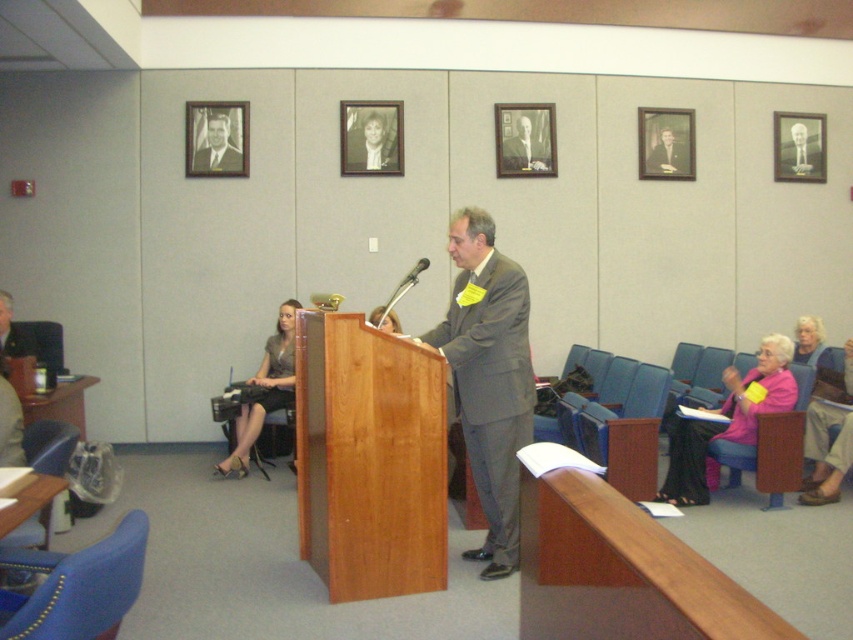
Between point (531, 140) and point (660, 157), which one is positioned behind?

Positioned behind is point (660, 157).

In the scene shown: Between smooth gray suit at center and formal suit at center, which one has less height?

With less height is formal suit at center.

Does point (515, 129) come closer to viewer compared to point (679, 147)?

That is True.

Locate an element on the screen. smooth gray suit at center is located at coordinates (526, 148).

Which of these two, gray suit at center or metallic gold picture frame at upper right, stands shorter?

metallic gold picture frame at upper right

You are a GUI agent. You are given a task and a screenshot of the screen. Output one action in this format:
    pyautogui.click(x=<x>, y=<y>)
    Task: Click on the gray suit at center
    Image resolution: width=853 pixels, height=640 pixels.
    Given the screenshot: What is the action you would take?
    pyautogui.click(x=488, y=378)

Can you confirm if black wood picture frame at upper center is thinner than metallic silver microphone at center?

No, black wood picture frame at upper center is not thinner than metallic silver microphone at center.

Which is behind, point (389, 116) or point (413, 282)?

Point (389, 116)

The height and width of the screenshot is (640, 853). I want to click on black wood picture frame at upper center, so click(370, 138).